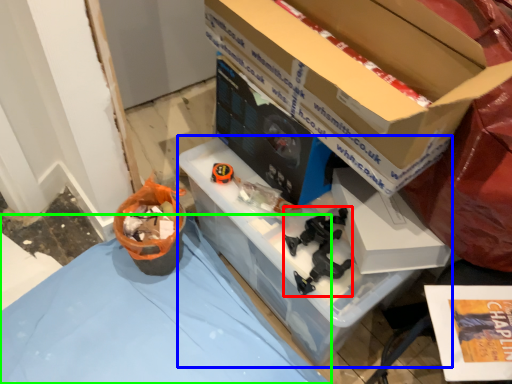
Question: Based on their relative distances, which object is nearer to toy (highlighted by a red box)? Choose from storage box (highlighted by a blue box) and tablecloth (highlighted by a green box).

Choices:
 (A) storage box
 (B) tablecloth

Answer: (A)